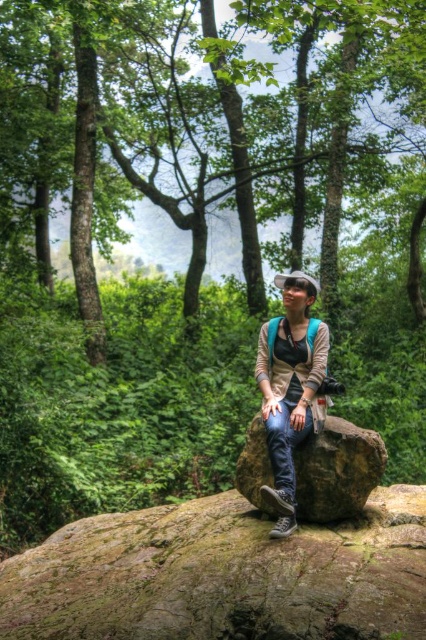
You are planning to take a photo of the green leafy tree at center and the brown rough rock at center. Which object should you focus on first if you want to capture both in a single frame without moving the camera?

The green leafy tree at center is taller than the brown rough rock at center, so you should focus on the green leafy tree at center first to ensure its full height fits in the frame while still capturing the brown rough rock at center.